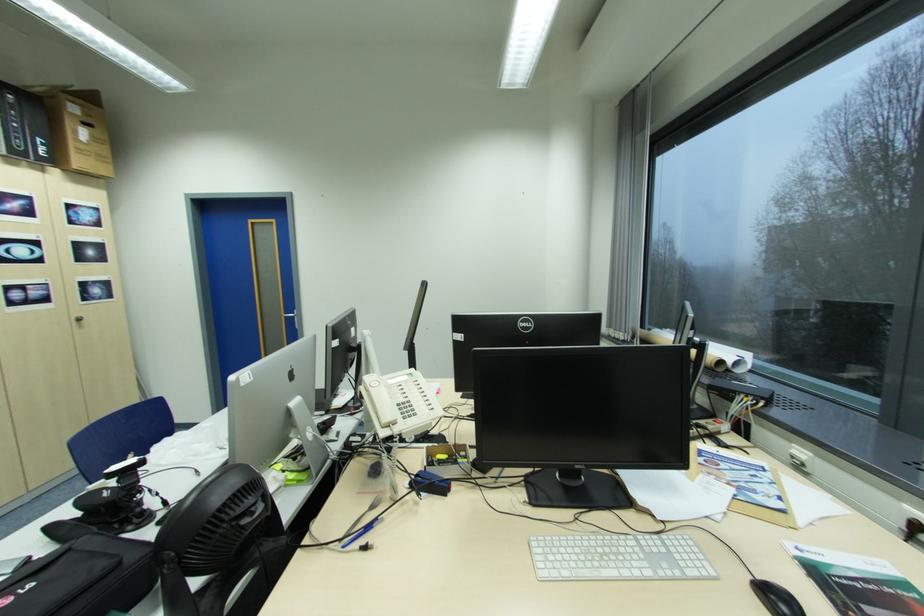
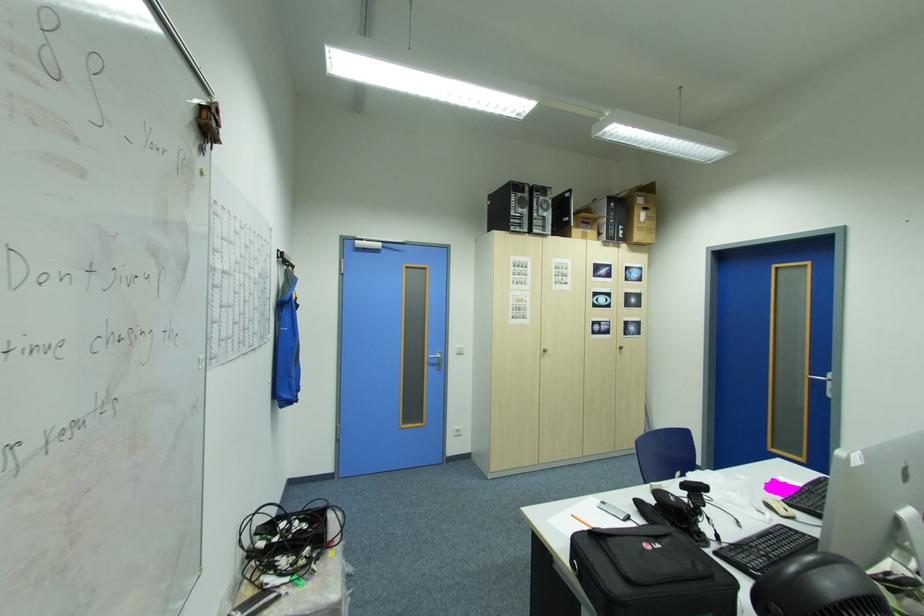
Find the pixel in the second image that matches pixel 126 483 in the first image.

(697, 496)